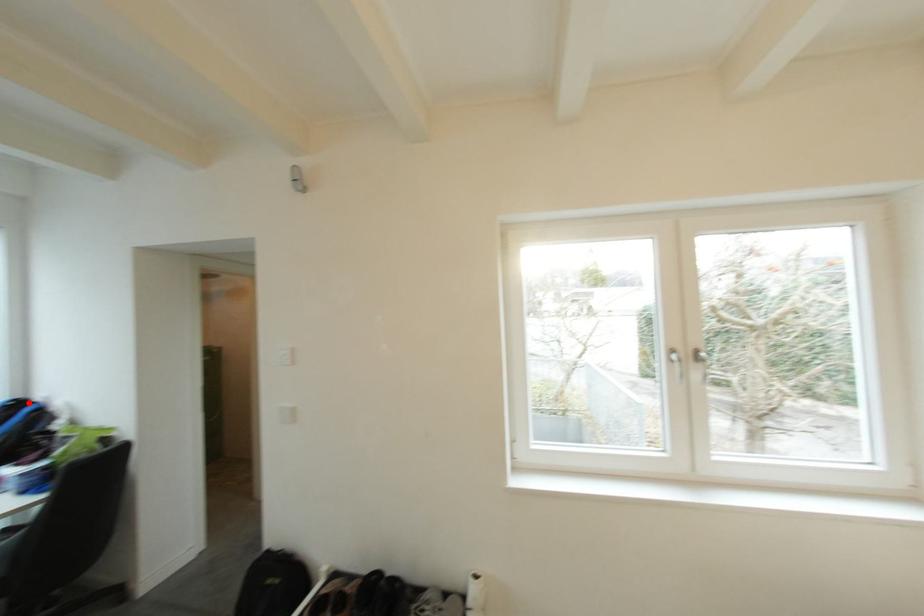
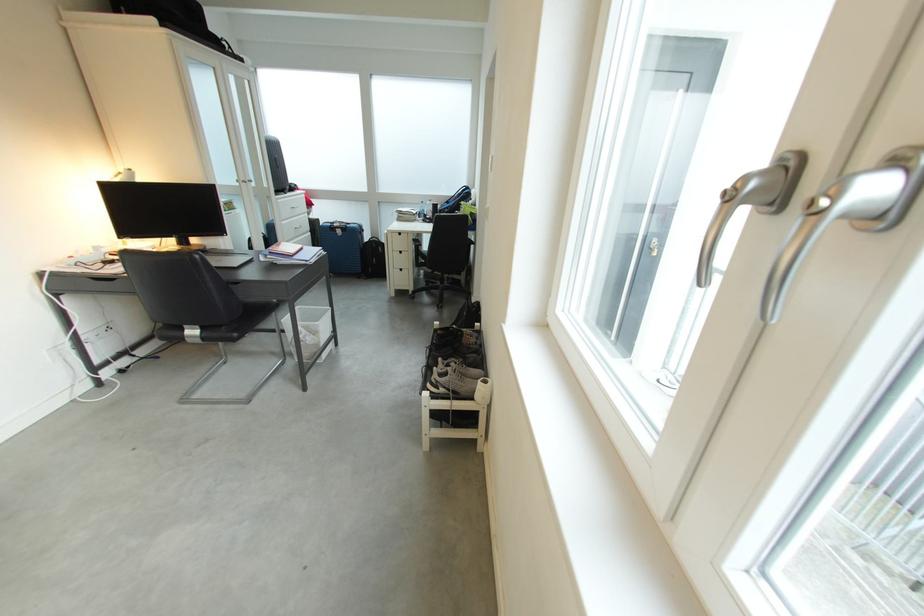
Question: I am providing you with two images of the same scene from different viewpoints. A red point is marked on the first image. Is the red point's position out of view in image 2?

Choices:
 (A) Yes
 (B) No

Answer: (A)